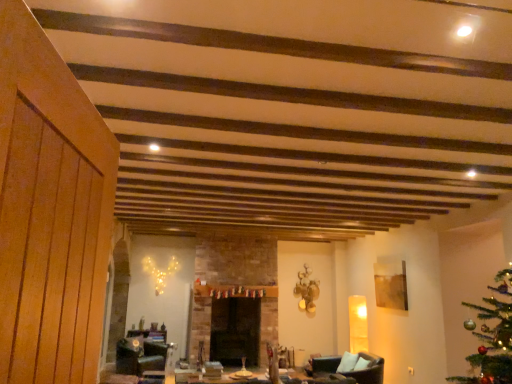
Find the location of a particular element. brown leather armchair at lower right is located at coordinates (369, 371).

The height and width of the screenshot is (384, 512). I want to click on black stone fireplace at center, so click(234, 331).

Is point (139, 363) farther from viewer compared to point (325, 371)?

Yes, it is behind point (325, 371).

Based on their positions, is black leather swivel chair at lower center located to the left or right of brown leather armchair at lower right?

black leather swivel chair at lower center is positioned on brown leather armchair at lower right's left side.

Which is correct: black leather swivel chair at lower center is inside brown leather armchair at lower right, or outside of it?

The correct answer is: outside.

Is black leather swivel chair at lower center positioned far away from brown leather armchair at lower right?

Yes.

Between brown leather armchair at lower right and black leather swivel chair at lower center, which one appears on the right side from the viewer's perspective?

brown leather armchair at lower right.

From a real-world perspective, who is located lower, brown leather armchair at lower right or black leather swivel chair at lower center?

From a 3D spatial view, black leather swivel chair at lower center is below.

Considering the sizes of objects brown leather armchair at lower right and black leather swivel chair at lower center in the image provided, who is bigger, brown leather armchair at lower right or black leather swivel chair at lower center?

With larger size is brown leather armchair at lower right.

Is brown leather armchair at lower right further to camera compared to black leather swivel chair at lower center?

No.

Is black leather swivel chair at lower center smaller than black stone fireplace at center?

Yes, black leather swivel chair at lower center is smaller than black stone fireplace at center.

Does point (143, 349) come in front of point (218, 349)?

Yes, point (143, 349) is closer to viewer.

Considering the sizes of objects black leather swivel chair at lower center and black stone fireplace at center in the image provided, who is thinner, black leather swivel chair at lower center or black stone fireplace at center?

With smaller width is black stone fireplace at center.

Is black leather swivel chair at lower center next to black stone fireplace at center?

There is a gap between black leather swivel chair at lower center and black stone fireplace at center.

Based on their sizes in the image, would you say black stone fireplace at center is bigger or smaller than brown leather armchair at lower right?

black stone fireplace at center is smaller than brown leather armchair at lower right.

Is black stone fireplace at center shorter than brown leather armchair at lower right?

No.

Is black stone fireplace at center beside brown leather armchair at lower right?

black stone fireplace at center and brown leather armchair at lower right are not in contact.

Is black stone fireplace at center positioned beyond the bounds of brown leather armchair at lower right?

Yes.

From the picture: Between brown leather armchair at lower right and black stone fireplace at center, which one has smaller width?

black stone fireplace at center is thinner.

From a real-world perspective, is brown leather armchair at lower right positioned above or below black stone fireplace at center?

brown leather armchair at lower right is below black stone fireplace at center.

Is brown leather armchair at lower right facing towards black stone fireplace at center?

No.

From the picture: Can you confirm if black stone fireplace at center is taller than black leather swivel chair at lower center?

Correct, black stone fireplace at center is much taller as black leather swivel chair at lower center.

Where is `swivel chair below the black stone fireplace at center (from the image's perspective)`? The height and width of the screenshot is (384, 512). swivel chair below the black stone fireplace at center (from the image's perspective) is located at coordinates (139, 356).

Which is behind, point (217, 319) or point (120, 371)?

Point (217, 319)

From the image's perspective, is black stone fireplace at center positioned above or below black leather swivel chair at lower center?

black stone fireplace at center is situated higher than black leather swivel chair at lower center in the image.

This screenshot has width=512, height=384. In order to click on swivel chair located on the left of brown leather armchair at lower right in this screenshot , I will do `click(139, 356)`.

I want to click on swivel chair that appears below the brown leather armchair at lower right (from the image's perspective), so click(x=139, y=356).

Which object lies nearer to the anchor point brown leather armchair at lower right, black leather swivel chair at lower center or black stone fireplace at center?

Among the two, black stone fireplace at center is located nearer to brown leather armchair at lower right.

Consider the image. Based on their spatial positions, is brown leather armchair at lower right or black leather swivel chair at lower center closer to black stone fireplace at center?

black leather swivel chair at lower center.

Based on their spatial positions, is black leather swivel chair at lower center or brown leather armchair at lower right further from black stone fireplace at center?

Among the two, brown leather armchair at lower right is located further to black stone fireplace at center.

Looking at the image, which one is located closer to black leather swivel chair at lower center, brown leather armchair at lower right or black stone fireplace at center?

Based on the image, black stone fireplace at center appears to be nearer to black leather swivel chair at lower center.

Considering their positions, is black stone fireplace at center positioned closer to black leather swivel chair at lower center than brown leather armchair at lower right?

black stone fireplace at center.

Looking at this image, looking at the image, which one is located further to brown leather armchair at lower right, black stone fireplace at center or black leather swivel chair at lower center?

The object further to brown leather armchair at lower right is black leather swivel chair at lower center.

Where is `fireplace between black leather swivel chair at lower center and brown leather armchair at lower right from left to right`? fireplace between black leather swivel chair at lower center and brown leather armchair at lower right from left to right is located at coordinates (234, 331).